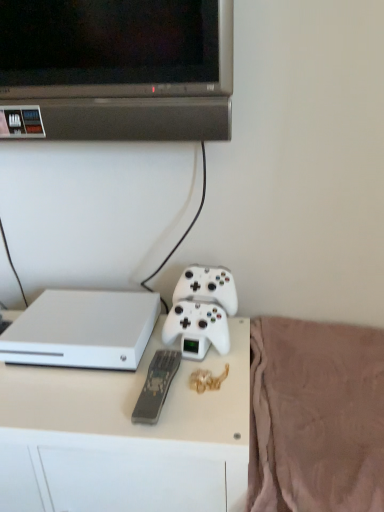
Question: Is white plastic desk at center inside the boundaries of gray matte remote at center, or outside?

Choices:
 (A) outside
 (B) inside

Answer: (A)

Question: From a real-world perspective, is white plastic desk at center above or below gray matte remote at center?

Choices:
 (A) below
 (B) above

Answer: (A)

Question: Which of these objects is positioned closest to the gray matte remote at center?

Choices:
 (A) white matte game controller at center
 (B) white plastic desk at center
 (C) white matte gaming console at lower left
 (D) pink soft fabric at lower right

Answer: (A)

Question: Considering the real-world distances, which object is farthest from the white matte gaming console at lower left?

Choices:
 (A) white matte game controller at center
 (B) gray matte remote at center
 (C) white plastic desk at center
 (D) pink soft fabric at lower right

Answer: (D)